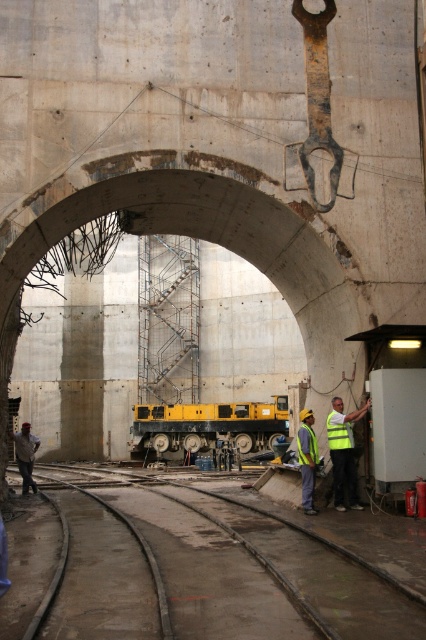
Is brown concrete track at center to the right of yellow reflective safety vest at center from the viewer's perspective?

Incorrect, brown concrete track at center is not on the right side of yellow reflective safety vest at center.

Does brown concrete track at center lie behind yellow reflective safety vest at center?

No, brown concrete track at center is in front of yellow reflective safety vest at center.

Measure the distance between brown concrete track at center and camera.

brown concrete track at center and camera are 6.68 meters apart from each other.

Where is `brown concrete track at center`? This screenshot has height=640, width=426. brown concrete track at center is located at coordinates (255, 572).

Which is below, reflective yellow safety vest at center or yellow reflective safety vest at center?

yellow reflective safety vest at center is lower down.

What do you see at coordinates (339, 432) in the screenshot? The image size is (426, 640). I see `reflective yellow safety vest at center` at bounding box center [339, 432].

Where is `reflective yellow safety vest at center`? Image resolution: width=426 pixels, height=640 pixels. reflective yellow safety vest at center is located at coordinates [339, 432].

Does yellow matte train at center have a greater width compared to yellow reflective vest at center?

Correct, the width of yellow matte train at center exceeds that of yellow reflective vest at center.

Who is positioned more to the right, yellow matte train at center or yellow reflective vest at center?

Positioned to the right is yellow matte train at center.

Is point (265, 420) farther from viewer compared to point (314, 509)?

Yes.

Locate an element on the screen. The width and height of the screenshot is (426, 640). yellow matte train at center is located at coordinates (209, 426).